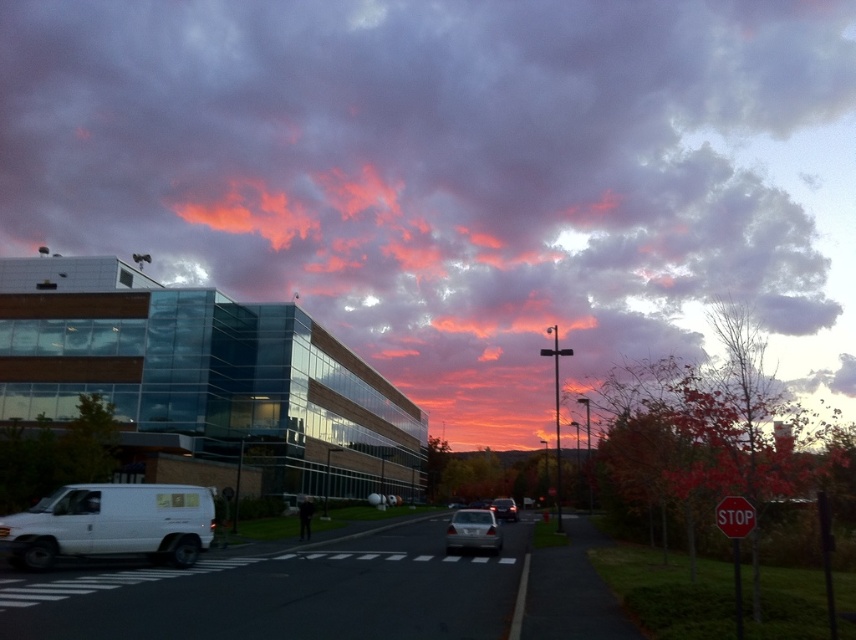
Question: Is purple translucent clouds at upper center below metallic silver sedan at center?

Choices:
 (A) yes
 (B) no

Answer: (B)

Question: Is metallic silver sedan at center wider than shiny silver sedan at center?

Choices:
 (A) yes
 (B) no

Answer: (B)

Question: Which point is farther to the camera?

Choices:
 (A) purple translucent clouds at upper center
 (B) red matte stop sign at center-right

Answer: (A)

Question: Which object is the farthest from the metallic silver sedan at center?

Choices:
 (A) red matte stop sign at center-right
 (B) white matte van at lower left

Answer: (A)

Question: Is the position of metallic silver sedan at center less distant than that of shiny silver sedan at center?

Choices:
 (A) yes
 (B) no

Answer: (A)

Question: Among these objects, which one is nearest to the camera?

Choices:
 (A) shiny silver sedan at center
 (B) white matte van at lower left
 (C) purple translucent clouds at upper center
 (D) red matte stop sign at center-right

Answer: (D)